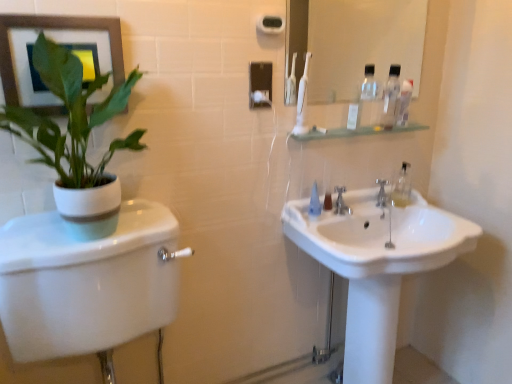
Question: In the image, is matte gray picture frame at upper left on the left side or the right side of white plastic toothpaste tube at upper center?

Choices:
 (A) left
 (B) right

Answer: (A)

Question: Considering the positions of matte gray picture frame at upper left and white plastic toothpaste tube at upper center in the image, is matte gray picture frame at upper left taller or shorter than white plastic toothpaste tube at upper center?

Choices:
 (A) short
 (B) tall

Answer: (B)

Question: Which object is the closest to the white glossy mirror at upper center?

Choices:
 (A) silver metallic faucet at center, the second tap positioned from the left
 (B) clear plastic mouthwash at upper right, which is the 1th mouthwash from top to bottom
 (C) white glossy toilet at left
 (D) white plastic toothbrush at upper center
 (E) white plastic towel bar at upper center

Answer: (D)

Question: Which object is positioned farthest from the silver metallic faucet at center, placed as the 2th tap when sorted from front to back?

Choices:
 (A) green matte plant at left
 (B) white plastic toothbrush at upper center
 (C) white plastic toothpaste tube at upper center
 (D) clear plastic mouthwash at upper right, which is the 1th mouthwash from top to bottom
 (E) white plastic towel bar at upper center

Answer: (A)